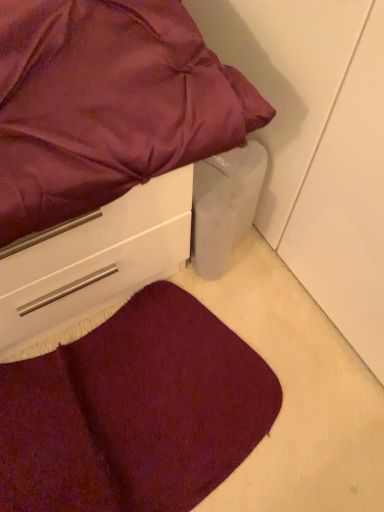
Question: From their relative heights in the image, would you say burgundy carpet at lower left is taller or shorter than satin purple bed at upper left?

Choices:
 (A) tall
 (B) short

Answer: (B)

Question: Do you think burgundy carpet at lower left is within satin purple bed at upper left, or outside of it?

Choices:
 (A) inside
 (B) outside

Answer: (B)

Question: In terms of size, does burgundy carpet at lower left appear bigger or smaller than satin purple bed at upper left?

Choices:
 (A) big
 (B) small

Answer: (B)

Question: Considering the positions of point [x=1, y=45] and point [x=125, y=311], is point [x=1, y=45] closer or farther from the camera than point [x=125, y=311]?

Choices:
 (A) closer
 (B) farther

Answer: (A)

Question: Considering the positions of satin purple bed at upper left and burgundy carpet at lower left in the image, is satin purple bed at upper left wider or thinner than burgundy carpet at lower left?

Choices:
 (A) thin
 (B) wide

Answer: (A)

Question: Considering the positions of satin purple bed at upper left and burgundy carpet at lower left in the image, is satin purple bed at upper left taller or shorter than burgundy carpet at lower left?

Choices:
 (A) short
 (B) tall

Answer: (B)

Question: Based on their sizes in the image, would you say satin purple bed at upper left is bigger or smaller than burgundy carpet at lower left?

Choices:
 (A) big
 (B) small

Answer: (A)